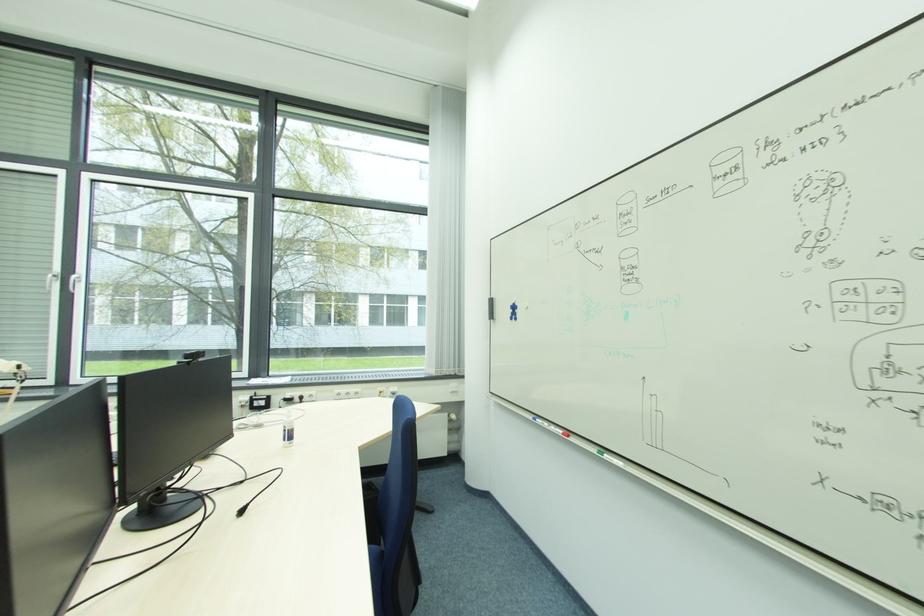
What do you see at coordinates (74, 282) in the screenshot?
I see `the white window handle` at bounding box center [74, 282].